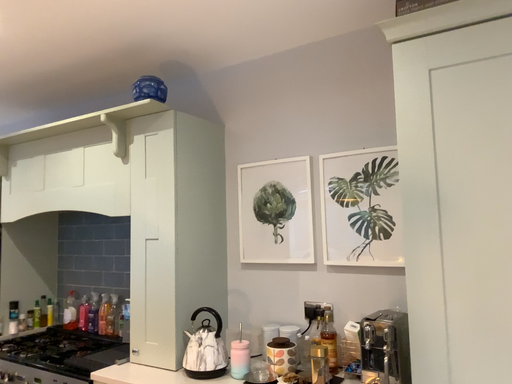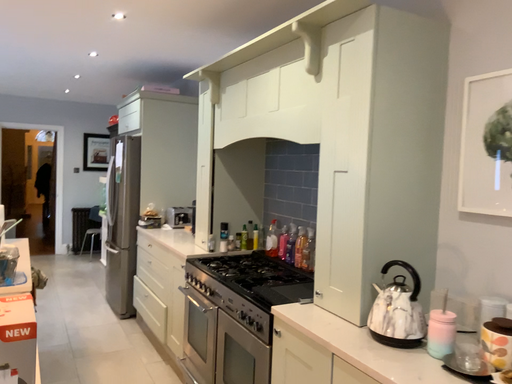
Question: How did the camera likely rotate when shooting the video?

Choices:
 (A) rotated upward
 (B) rotated downward

Answer: (B)